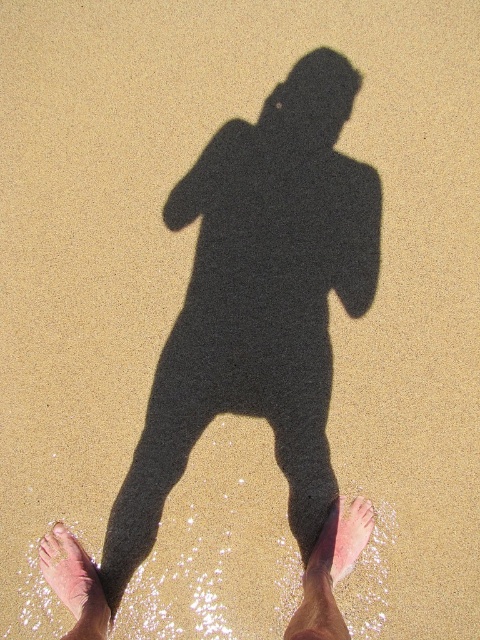
Does pink skin at lower center have a lesser height compared to pink flesh at lower left?

No.

Which is above, pink skin at lower center or pink flesh at lower left?

Positioned higher is pink flesh at lower left.

Which is in front, point (317, 556) or point (54, 531)?

Point (317, 556) is in front.

Where is `pink skin at lower center`? This screenshot has height=640, width=480. pink skin at lower center is located at coordinates (339, 541).

Between pink flesh at lower center and pink flesh at lower left, which one is positioned lower?

pink flesh at lower center is below.

Who is more forward, [71,552] or [55,522]?

Point [71,552]

At what (x,y) coordinates should I click in order to perform the action: click on pink flesh at lower center. Please return your answer as a coordinate pair (x, y). This screenshot has height=640, width=480. Looking at the image, I should click on (74, 586).

I want to click on pink flesh at lower center, so click(74, 586).

What do you see at coordinates (74, 586) in the screenshot? This screenshot has height=640, width=480. I see `pink flesh at lower center` at bounding box center [74, 586].

Does pink flesh at lower center have a larger size compared to pink skin at lower center?

Yes.

Does point (83, 584) lie behind point (363, 497)?

That is False.

In order to click on pink flesh at lower center in this screenshot , I will do `click(74, 586)`.